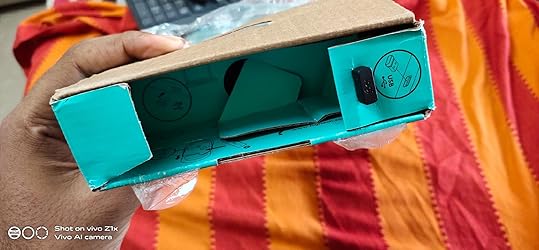
Locate an element on the screen. box is located at coordinates (118, 146).